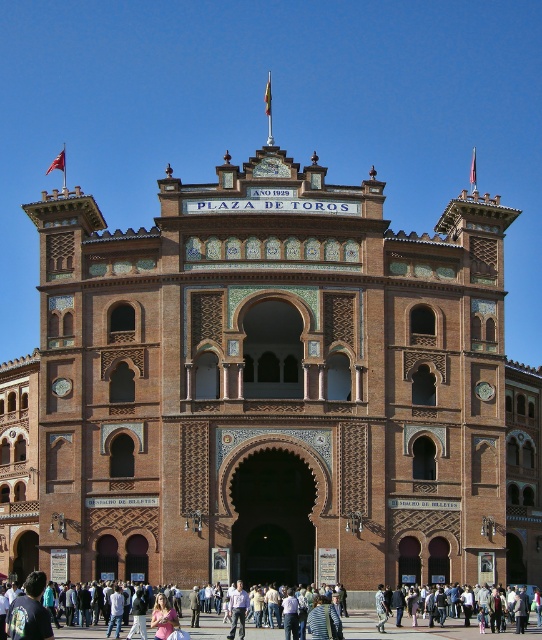
Which of these two, light brown leather jacket at lower center or light blue shirt at center, stands shorter?

light blue shirt at center is shorter.

Is light brown leather jacket at lower center shorter than light blue shirt at center?

In fact, light brown leather jacket at lower center may be taller than light blue shirt at center.

Find the location of a particular element. light brown leather jacket at lower center is located at coordinates (489, 620).

This screenshot has height=640, width=542. Identify the location of light brown leather jacket at lower center. (489, 620).

What do you see at coordinates (489, 620) in the screenshot? The width and height of the screenshot is (542, 640). I see `light brown leather jacket at lower center` at bounding box center [489, 620].

Between point (459, 627) and point (35, 605), which one is positioned in front?

Point (35, 605) is in front.

The width and height of the screenshot is (542, 640). I want to click on light brown leather jacket at lower center, so click(x=489, y=620).

Is light pink fabric dress at lower center positioned before light blue shirt at center?

That is False.

Which is more to the left, light pink fabric dress at lower center or light blue shirt at center?

light blue shirt at center

Which is behind, point (189, 618) or point (241, 636)?

The point (189, 618) is behind.

Where is `light pink fabric dress at lower center`? Image resolution: width=542 pixels, height=640 pixels. light pink fabric dress at lower center is located at coordinates (427, 628).